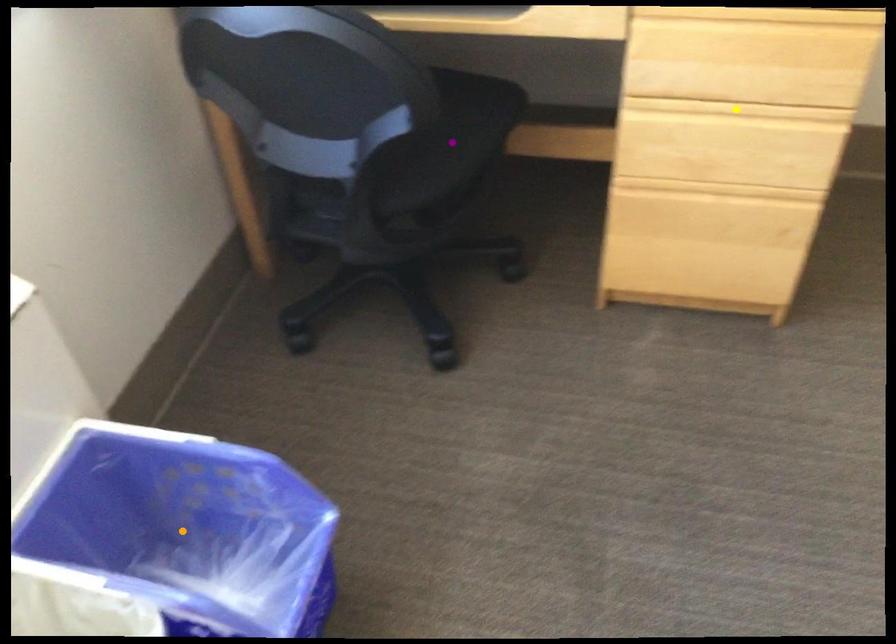
Order these from nearest to farthest:
A) purple point
B) yellow point
C) orange point

orange point
yellow point
purple point